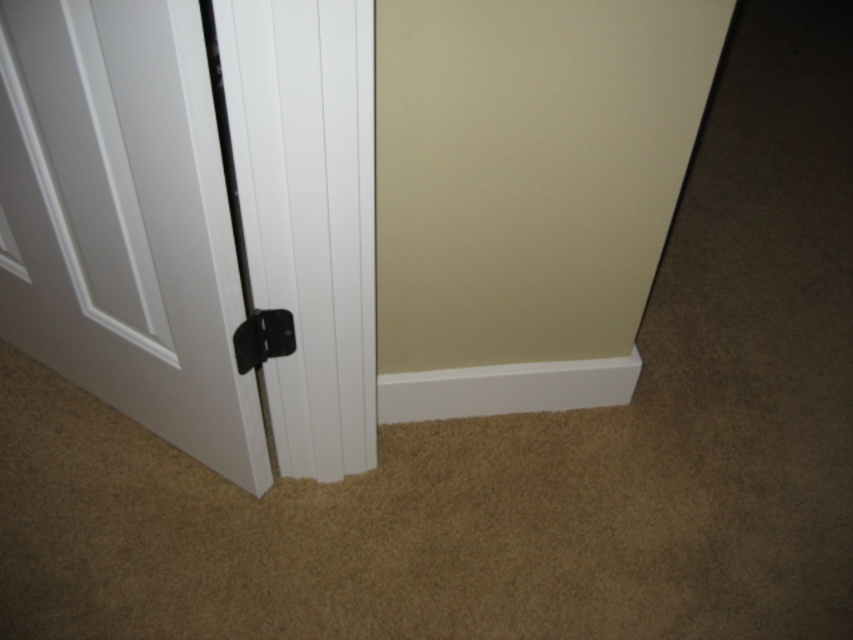
Which is more to the right, white matte door at lower left or black plastic door handle at center?

From the viewer's perspective, black plastic door handle at center appears more on the right side.

Describe the element at coordinates (123, 220) in the screenshot. Image resolution: width=853 pixels, height=640 pixels. I see `white matte door at lower left` at that location.

This screenshot has width=853, height=640. I want to click on white matte door at lower left, so click(123, 220).